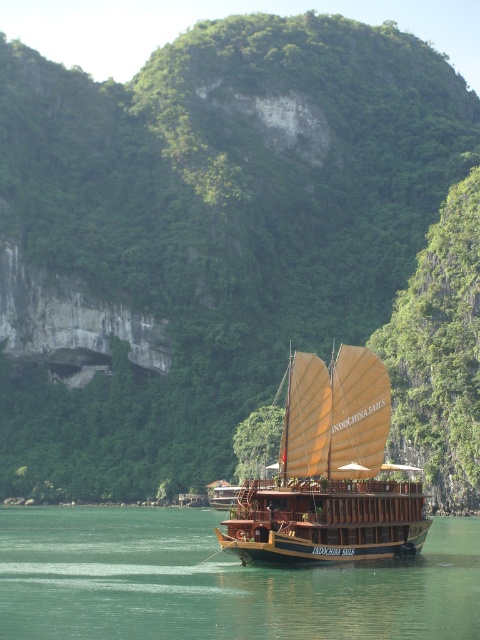
You are standing on the deck of the boat named Indochina Sails. You want to reach a point marked at coordinates point (121, 547). If your maximum reach is 250 feet, can you reach that point without moving from your current position?

The point (121, 547) is 290.98 feet away from you, which exceeds your maximum reach of 250 feet. Therefore, you cannot reach it without moving.

You are a sailor planning to anchor your boat near the wooden sailboat at center. The green water at boat right has a depth that corresponds to its height in the image. Can your boat, which requires 2 meters of depth, safely anchor there?

The green water at boat right is shorter than the wooden sailboat at center. Since the wooden sailboat at center is presumably anchored in deeper water, the green water at boat right being shorter might indicate shallower depth. However, without specific depth measurements, it is uncertain if the 2 meters requirement is met. Further information is needed.

You are standing on the wooden sailboat at center and want to look at the green water at boat right. In which direction should you look relative to the boat?

You should look downward since the green water at boat right is below the wooden sailboat at center.